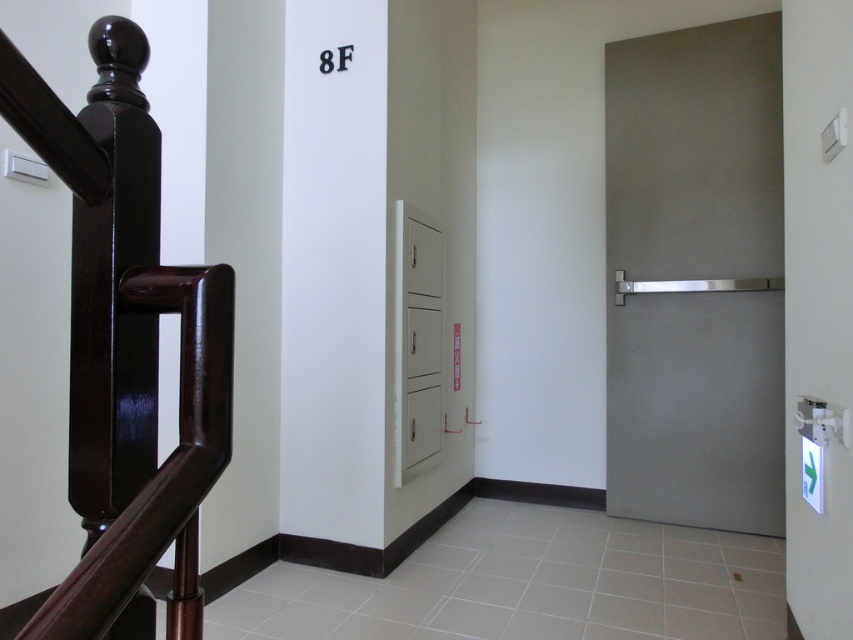
Question: Considering the relative positions of satin silver door at right and glossy wood handrail at left in the image provided, where is satin silver door at right located with respect to glossy wood handrail at left?

Choices:
 (A) below
 (B) above

Answer: (B)

Question: Among these objects, which one is nearest to the camera?

Choices:
 (A) satin silver door at right
 (B) white matte cabinet at center

Answer: (B)

Question: Which of these objects is positioned farthest from the satin silver door at right?

Choices:
 (A) white matte cabinet at center
 (B) glossy wood handrail at left

Answer: (B)

Question: Is satin silver door at right behind glossy wood handrail at left?

Choices:
 (A) yes
 (B) no

Answer: (A)

Question: Does glossy wood handrail at left appear under white matte cabinet at center?

Choices:
 (A) no
 (B) yes

Answer: (A)

Question: Which object is positioned closest to the glossy wood handrail at left?

Choices:
 (A) white matte cabinet at center
 (B) satin silver door at right

Answer: (A)